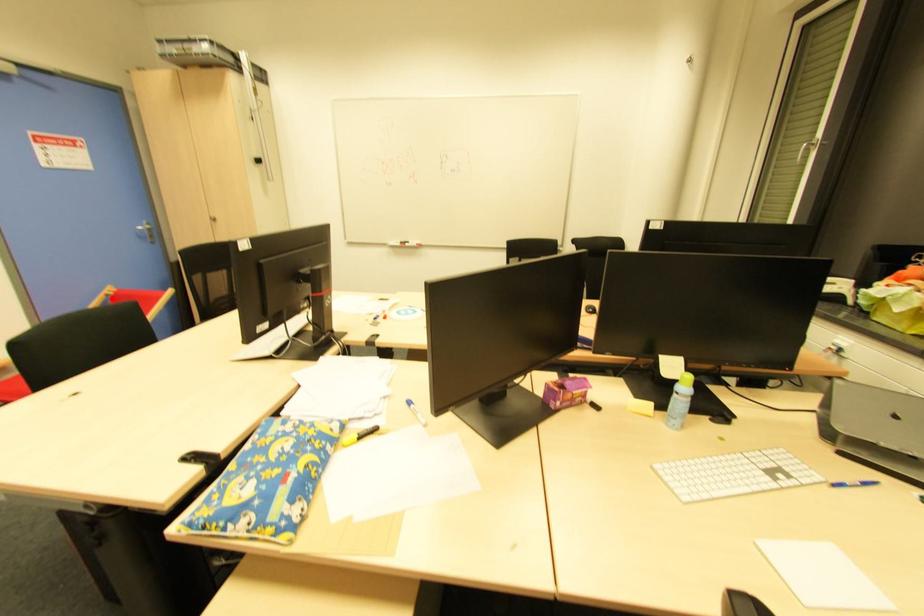
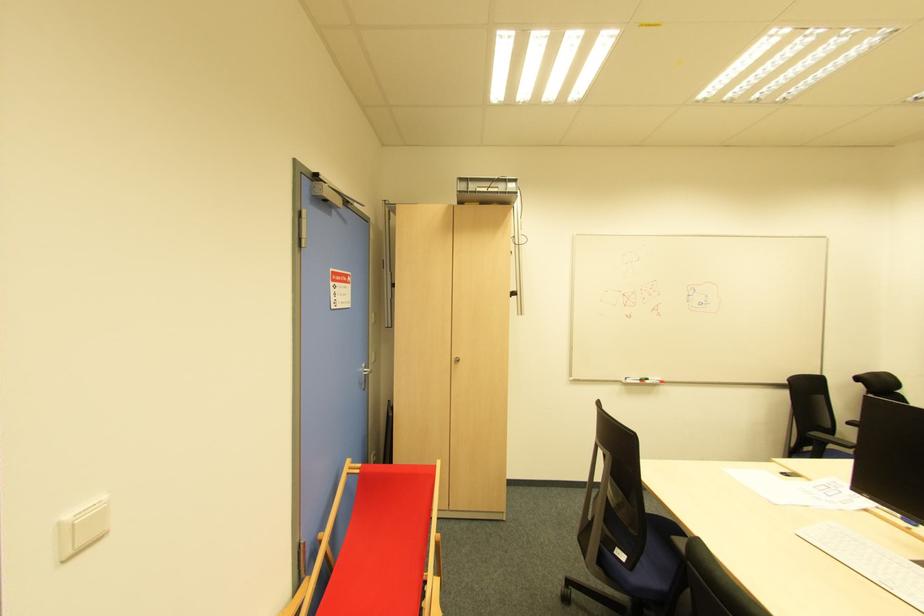
Question: I am providing you with two images of the same scene from different viewpoints. Image1 has a red point marked. In image2, the corresponding 3D location appears at what relative position? Reply with the corresponding letter.

Choices:
 (A) Closer
 (B) Farther

Answer: (A)